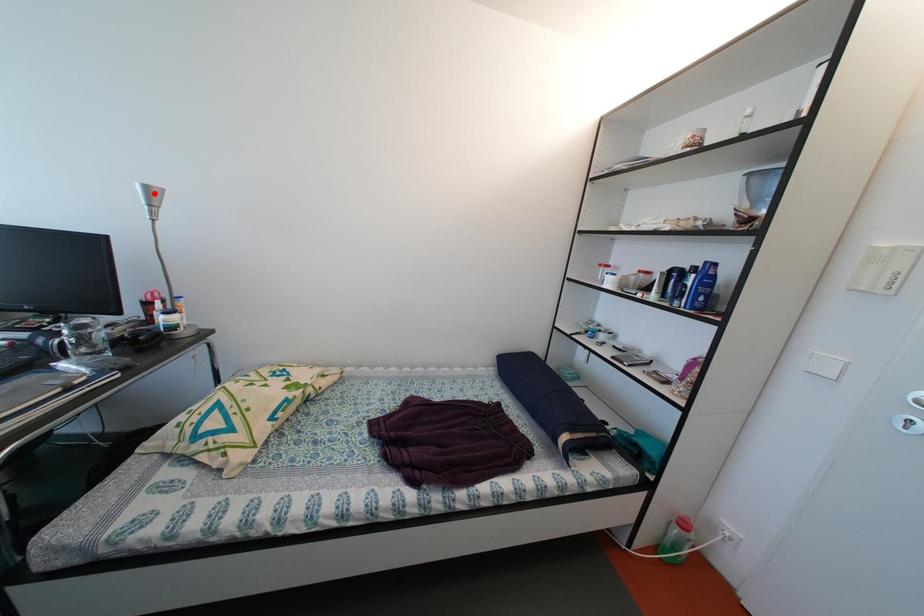
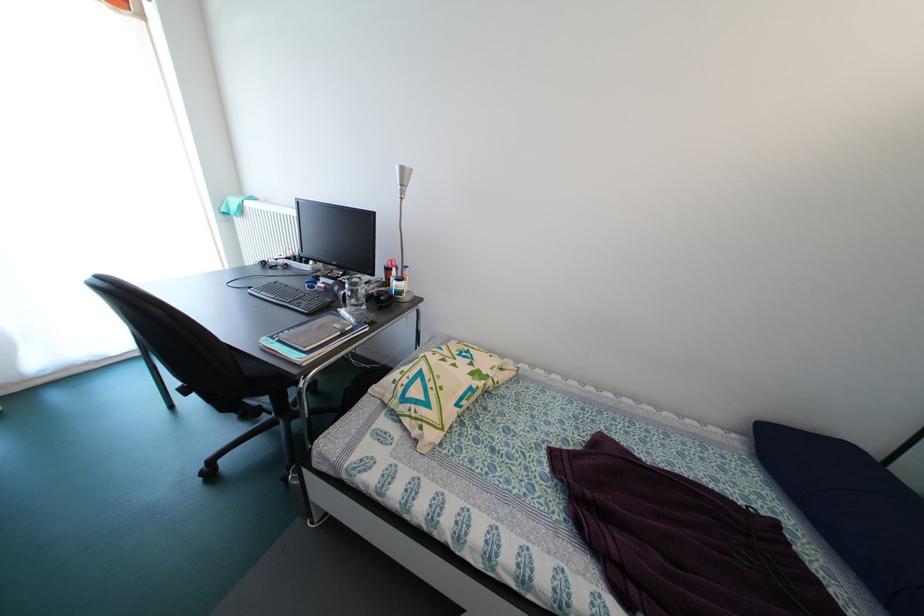
In the second image, find the point that corresponds to the highlighted location in the first image.

(409, 175)